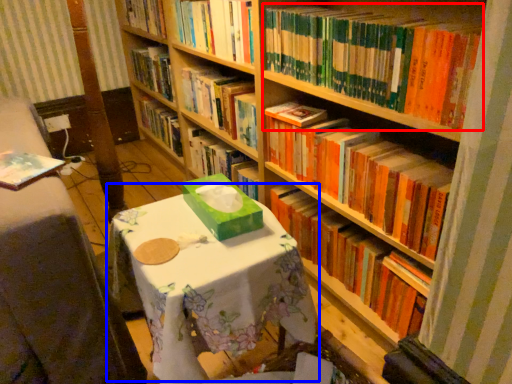
Question: Which of the following is the closest to the observer, book (highlighted by a red box) or round table (highlighted by a blue box)?

Choices:
 (A) book
 (B) round table

Answer: (B)